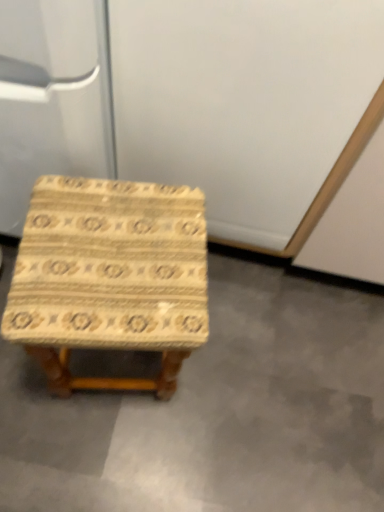
Find the location of a particular element. Image resolution: width=384 pixels, height=512 pixels. empty space that is ontop of beige textured stool at center (from a real-world perspective) is located at coordinates (224, 391).